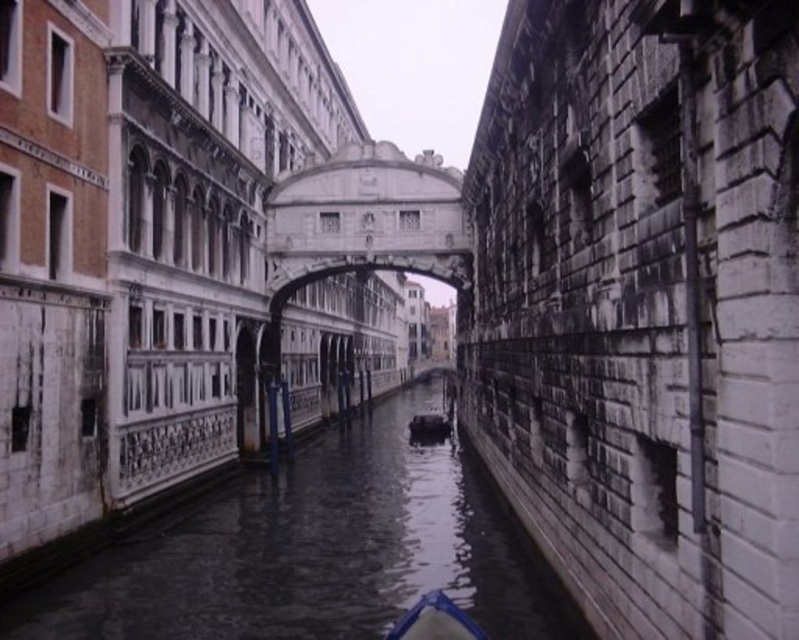
Question: Is smooth stone canal at center wider than black rubber boat at center?

Choices:
 (A) no
 (B) yes

Answer: (B)

Question: Which point is farther from the camera taking this photo?

Choices:
 (A) (426, 634)
 (B) (279, 372)
 (C) (436, 426)
 (D) (132, 573)

Answer: (C)

Question: Which object is the farthest from the black rubber boat at center?

Choices:
 (A) blue plastic boat at center
 (B) smooth stone canal at center

Answer: (A)

Question: Which of the following is the farthest from the observer?

Choices:
 (A) smooth stone canal at center
 (B) white stone bridge at center

Answer: (B)

Question: Can you confirm if smooth stone canal at center is wider than black rubber boat at center?

Choices:
 (A) yes
 (B) no

Answer: (A)

Question: Observing the image, what is the correct spatial positioning of white stone bridge at center in reference to black rubber boat at center?

Choices:
 (A) above
 (B) below

Answer: (A)